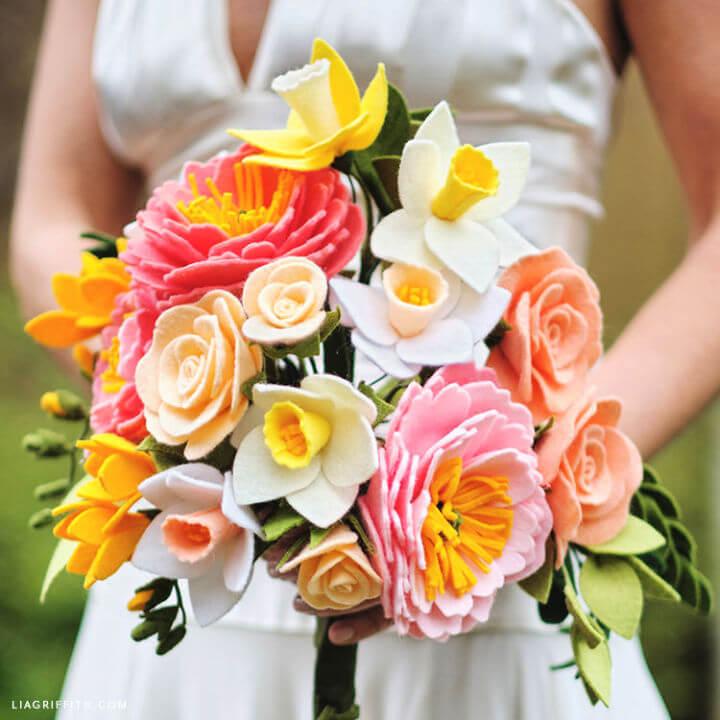
The image size is (720, 720). Identify the location of fake leaves. (628, 623).